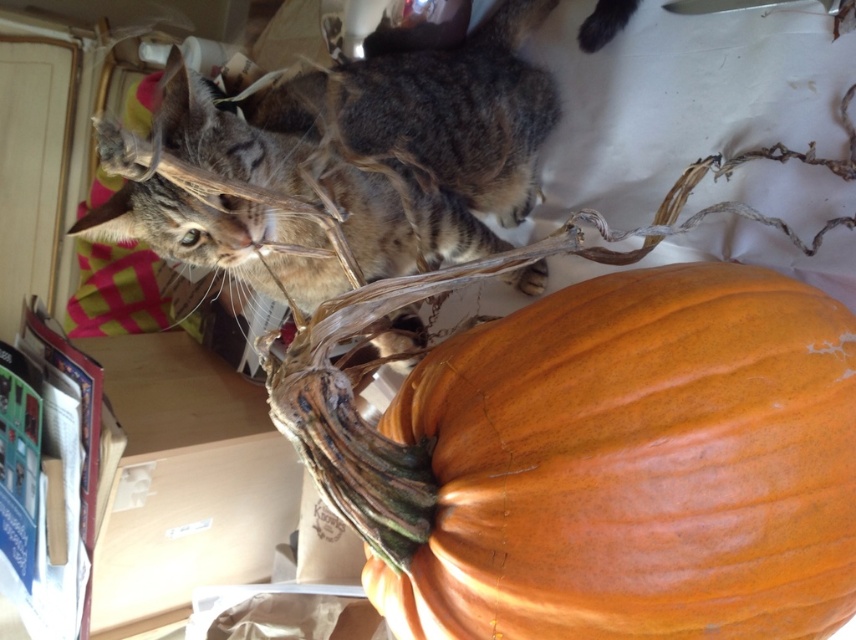
Question: Can you confirm if orange matte pumpkin at center is wider than wooden table at lower left?

Choices:
 (A) no
 (B) yes

Answer: (B)

Question: Is orange matte pumpkin at center positioned at the back of wooden table at lower left?

Choices:
 (A) yes
 (B) no

Answer: (B)

Question: Does orange matte pumpkin at center appear on the left side of wooden table at lower left?

Choices:
 (A) yes
 (B) no

Answer: (B)

Question: Which point is farther to the camera?

Choices:
 (A) wooden table at lower left
 (B) orange matte pumpkin at center

Answer: (A)